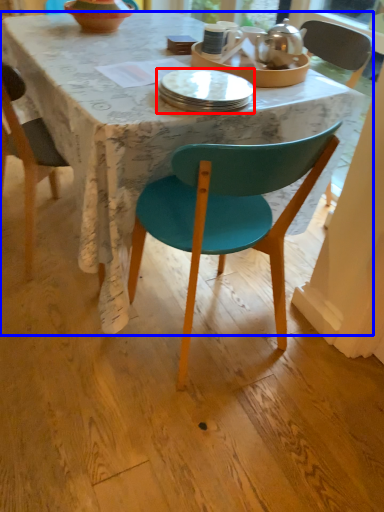
Question: Which object is further to the camera taking this photo, plate (highlighted by a red box) or desk (highlighted by a blue box)?

Choices:
 (A) plate
 (B) desk

Answer: (A)